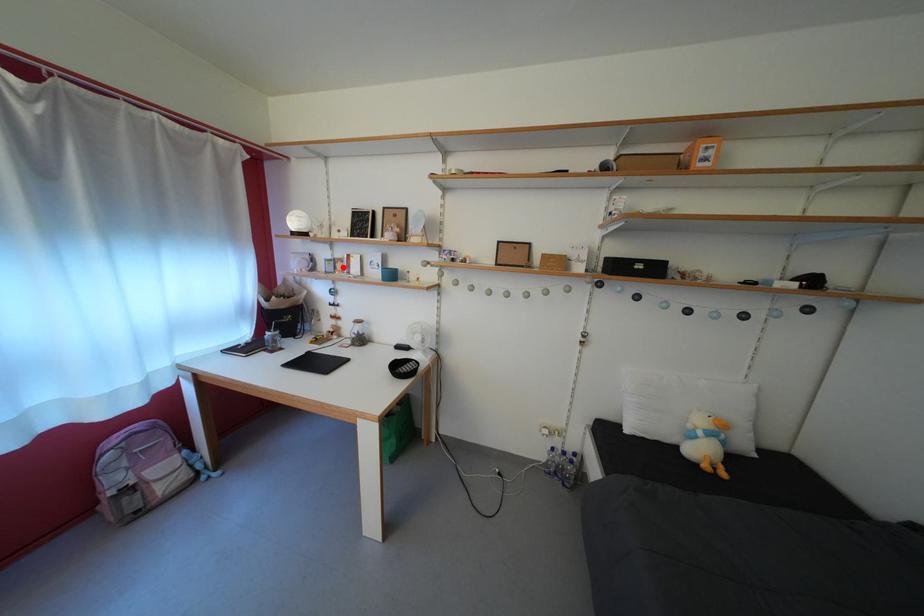
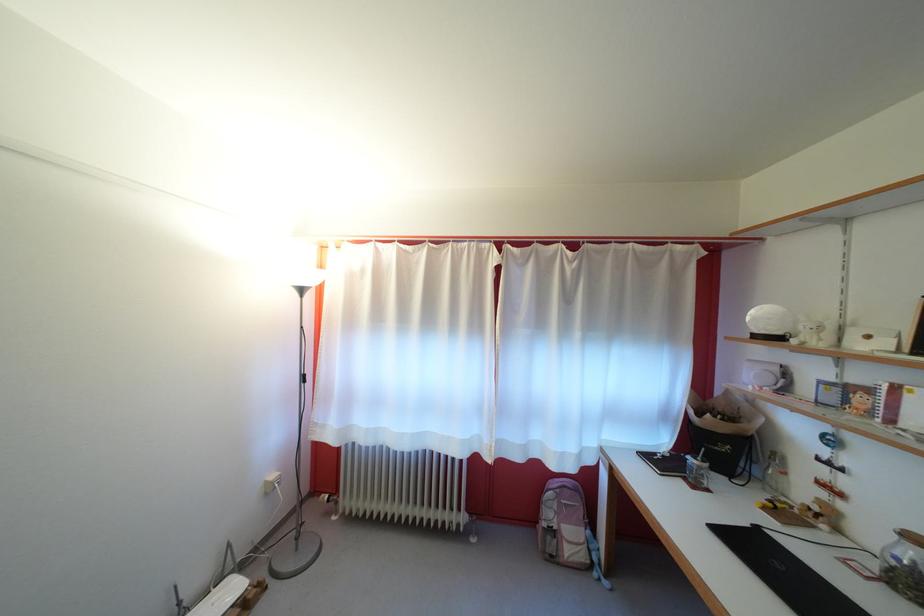
Question: I am providing you with two images of the same scene from different viewpoints. A red point is marked on the first image. At the location where the point appears in image 1, is it still visible in image 2?

Choices:
 (A) Yes
 (B) No

Answer: (A)